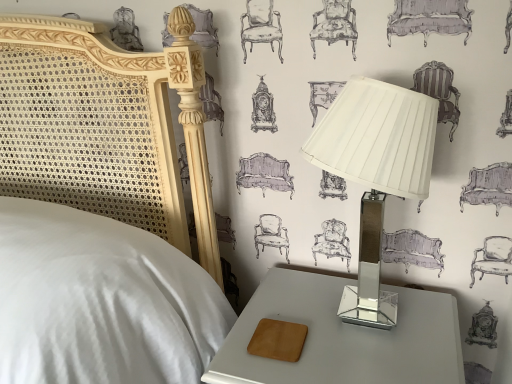
Where is `vacant area on top of metallic gray nightstand at lower right (from a real-world perspective)`? This screenshot has width=512, height=384. vacant area on top of metallic gray nightstand at lower right (from a real-world perspective) is located at coordinates (339, 329).